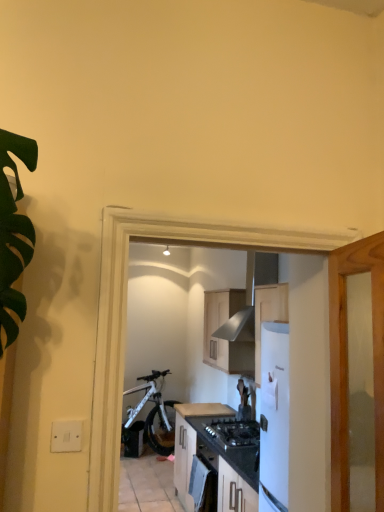
Question: Is white matte bicycle at center surrounded by white matte cabinet at center, the first cabinetry in the bottom-to-top sequence?

Choices:
 (A) yes
 (B) no

Answer: (B)

Question: From a real-world perspective, does white matte cabinet at center, the second cabinetry in the top-to-bottom sequence, sit lower than white matte bicycle at center?

Choices:
 (A) no
 (B) yes

Answer: (B)

Question: Does white matte cabinet at center, the second cabinetry in the top-to-bottom sequence, have a greater height compared to white matte bicycle at center?

Choices:
 (A) yes
 (B) no

Answer: (B)

Question: Is white matte cabinet at center, the second cabinetry in the top-to-bottom sequence, thinner than white matte bicycle at center?

Choices:
 (A) yes
 (B) no

Answer: (B)

Question: From the image's perspective, would you say white matte cabinet at center, the second cabinetry in the top-to-bottom sequence, is shown under white matte bicycle at center?

Choices:
 (A) yes
 (B) no

Answer: (B)

Question: From the image's perspective, is wooden cabinet at center, arranged as the 2th cabinetry when ordered from the bottom, above or below satin black oven at center?

Choices:
 (A) above
 (B) below

Answer: (A)

Question: Would you say wooden cabinet at center, marked as the first cabinetry in a top-to-bottom arrangement, is to the left or to the right of satin black oven at center in the picture?

Choices:
 (A) left
 (B) right

Answer: (B)

Question: Is wooden cabinet at center, arranged as the 2th cabinetry when ordered from the bottom, wider or thinner than satin black oven at center?

Choices:
 (A) wide
 (B) thin

Answer: (A)

Question: Looking at the image, does wooden cabinet at center, arranged as the 2th cabinetry when ordered from the bottom, seem bigger or smaller compared to satin black oven at center?

Choices:
 (A) big
 (B) small

Answer: (A)

Question: Considering the positions of white matte cabinet at center, the first cabinetry in the bottom-to-top sequence, and wooden cabinet at center, marked as the first cabinetry in a top-to-bottom arrangement, in the image, is white matte cabinet at center, the first cabinetry in the bottom-to-top sequence, taller or shorter than wooden cabinet at center, marked as the first cabinetry in a top-to-bottom arrangement,?

Choices:
 (A) tall
 (B) short

Answer: (A)

Question: From the image's perspective, is white matte cabinet at center, the second cabinetry in the top-to-bottom sequence, located above or below wooden cabinet at center, marked as the first cabinetry in a top-to-bottom arrangement?

Choices:
 (A) above
 (B) below

Answer: (B)

Question: From a real-world perspective, is white matte cabinet at center, the first cabinetry in the bottom-to-top sequence, above or below wooden cabinet at center, marked as the first cabinetry in a top-to-bottom arrangement?

Choices:
 (A) above
 (B) below

Answer: (B)

Question: Is white matte cabinet at center, the second cabinetry in the top-to-bottom sequence, bigger or smaller than wooden cabinet at center, arranged as the 2th cabinetry when ordered from the bottom?

Choices:
 (A) big
 (B) small

Answer: (A)

Question: Considering the positions of white matte bicycle at center and matte brown countertop at center in the image, is white matte bicycle at center taller or shorter than matte brown countertop at center?

Choices:
 (A) short
 (B) tall

Answer: (B)

Question: Is white matte bicycle at center in front of or behind matte brown countertop at center in the image?

Choices:
 (A) behind
 (B) front

Answer: (A)